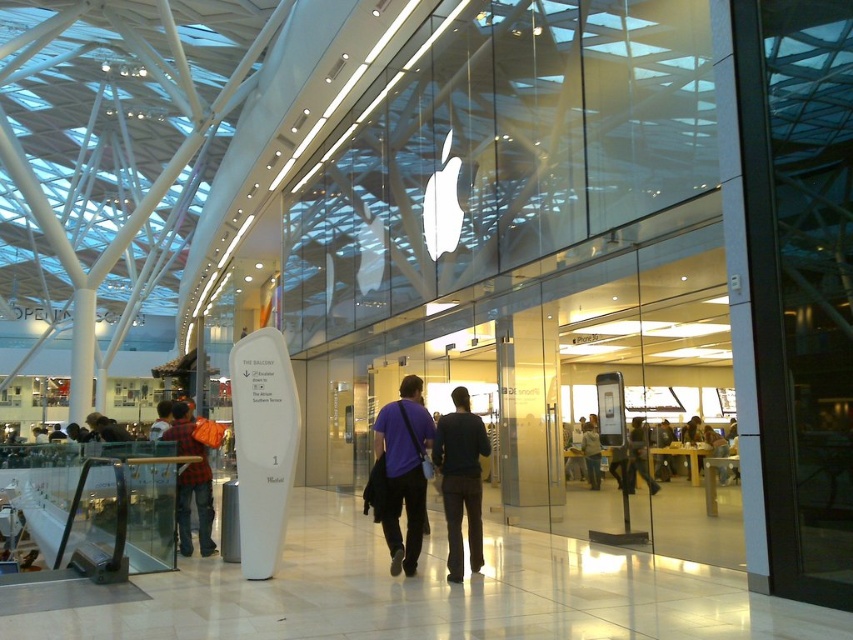
You are a photographer taking a photo of the Apple Store interior. You notice a purple fabric shirt at center and a plaid shirt at left in your frame. Based on their positions, which shirt appears closer to the camera?

The purple fabric shirt at center appears closer to the camera because it is located above the plaid shirt at left, indicating it is in a more forward position in the scene.

Consider the image. You are a photographer standing in the mall and see the purple fabric shirt at center and the plaid shirt at left. Which shirt would appear narrower in your photo?

The purple fabric shirt at center would appear narrower in the photo because it is thinner than the plaid shirt at left.